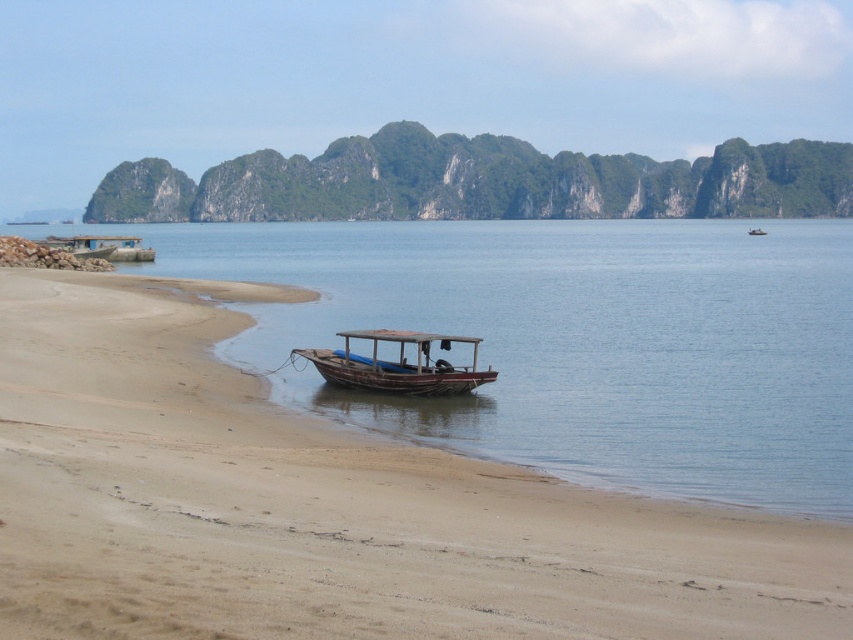
Question: Among these objects, which one is nearest to the camera?

Choices:
 (A) brown sandy beach at center
 (B) rusty wooden boat at center

Answer: (A)

Question: Is brown sandy beach at center positioned before rusty wooden boat at center?

Choices:
 (A) no
 (B) yes

Answer: (B)

Question: Does brown sandy beach at center have a smaller size compared to rusty wooden boat at center?

Choices:
 (A) yes
 (B) no

Answer: (B)

Question: Which of the following is the farthest from the observer?

Choices:
 (A) (99, 285)
 (B) (404, 381)

Answer: (A)

Question: Is brown sandy beach at center behind rusty wooden boat at center?

Choices:
 (A) no
 (B) yes

Answer: (A)

Question: Among these objects, which one is farthest from the camera?

Choices:
 (A) brown sandy beach at center
 (B) rusty wooden boat at center

Answer: (B)